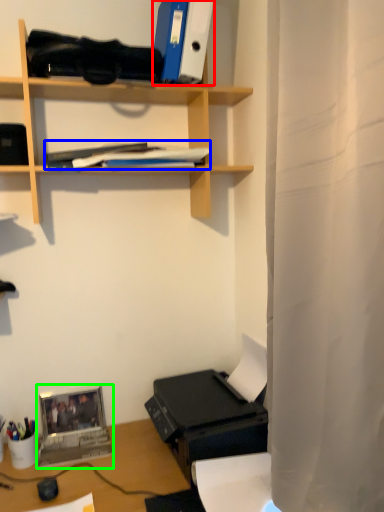
Question: Which object is the farthest from paperback book (highlighted by a red box)? Choose among these: book (highlighted by a blue box) or laptop (highlighted by a green box).

Choices:
 (A) book
 (B) laptop

Answer: (B)